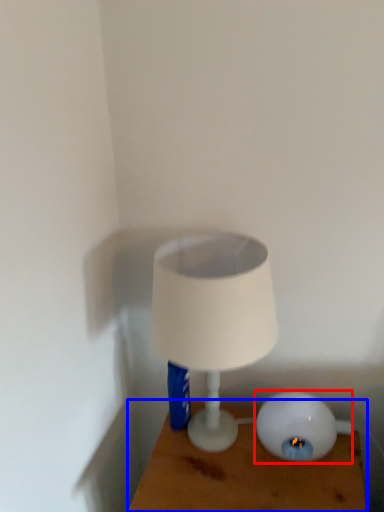
Question: Which object is further to the camera taking this photo, lamp (highlighted by a red box) or furniture (highlighted by a blue box)?

Choices:
 (A) lamp
 (B) furniture

Answer: (A)